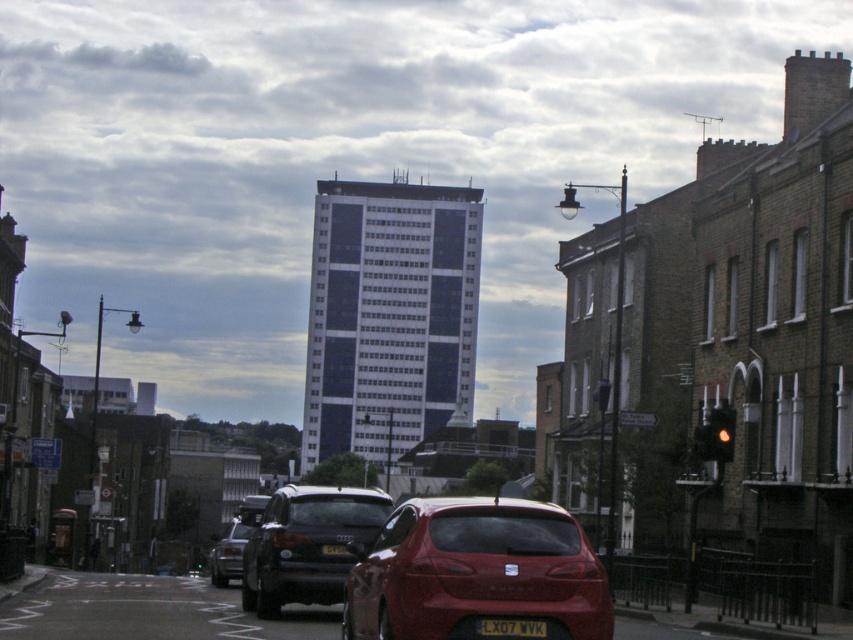
Question: Can you confirm if shiny black sedan at center is positioned above black plastic license plate at center?

Choices:
 (A) yes
 (B) no

Answer: (B)

Question: Estimate the real-world distances between objects in this image. Which object is closer to the shiny black car at center?

Choices:
 (A) shiny red hatchback at center
 (B) yellow matte license plate at center
 (C) shiny black sedan at center
 (D) black plastic license plate at center

Answer: (B)

Question: In this image, where is yellow glass traffic light at right located relative to black plastic license plate at center?

Choices:
 (A) right
 (B) left

Answer: (A)

Question: Which object appears closest to the camera in this image?

Choices:
 (A) black plastic license plate at center
 (B) shiny black sedan at center
 (C) shiny red hatchback at center

Answer: (C)

Question: From the image, what is the correct spatial relationship of shiny red hatchback at center in relation to yellow glass traffic light at right?

Choices:
 (A) right
 (B) left

Answer: (B)

Question: Estimate the real-world distances between objects in this image. Which object is farther from the shiny black car at center?

Choices:
 (A) yellow glass traffic light at right
 (B) yellow matte license plate at center

Answer: (A)